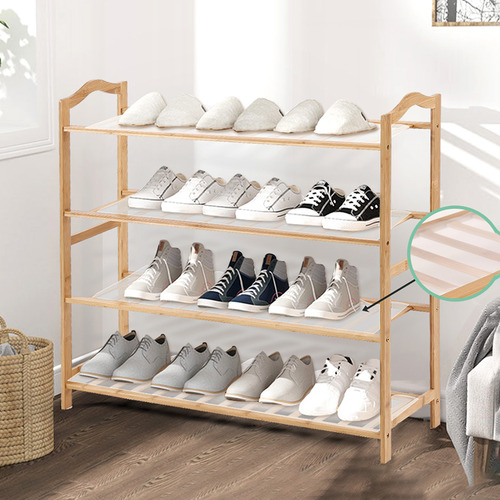
The height and width of the screenshot is (500, 500). I want to click on shoes on bottom shelf, so click(x=107, y=359), click(x=133, y=364), click(x=176, y=371), click(x=200, y=377), click(x=239, y=384), click(x=277, y=389), click(x=321, y=391), click(x=362, y=405).